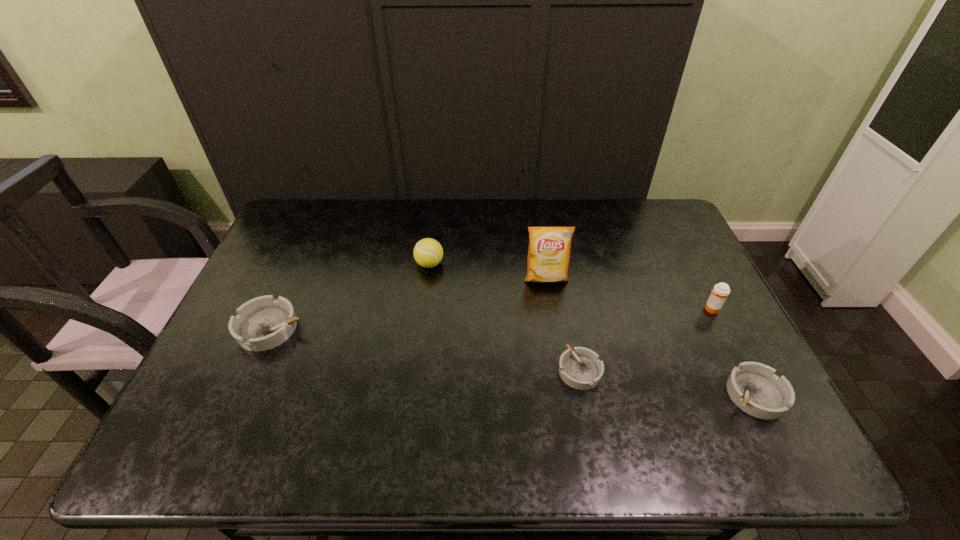
The width and height of the screenshot is (960, 540). In order to click on free spot at the near edge of the desktop in this screenshot , I will do `click(500, 402)`.

Locate an element on the screen. This screenshot has height=540, width=960. free space at the left edge of the desktop is located at coordinates (296, 254).

The height and width of the screenshot is (540, 960). I want to click on vacant space at the right edge of the desktop, so click(x=691, y=247).

Identify the location of free space at the far left corner of the desktop. (310, 218).

In the image, there is a desktop. Where is `vacant space at the far right corner`? vacant space at the far right corner is located at coordinates (670, 211).

Where is `vacant space that is in between the second ashtray from left to right and the medicine`? vacant space that is in between the second ashtray from left to right and the medicine is located at coordinates (645, 340).

Identify the location of vacant area that lies between the shortest object and the tennis ball. This screenshot has width=960, height=540. click(505, 317).

Locate an element on the screen. free space between the medicine and the second ashtray from left to right is located at coordinates 645,340.

You are a GUI agent. You are given a task and a screenshot of the screen. Output one action in this format:
    pyautogui.click(x=<x>, y=<y>)
    Task: Click on the free spot between the second object from left to right and the tallest object
    Image resolution: width=960 pixels, height=540 pixels.
    Given the screenshot: What is the action you would take?
    pyautogui.click(x=488, y=271)

I want to click on vacant area that lies between the tennis ball and the second shortest ashtray, so click(x=592, y=329).